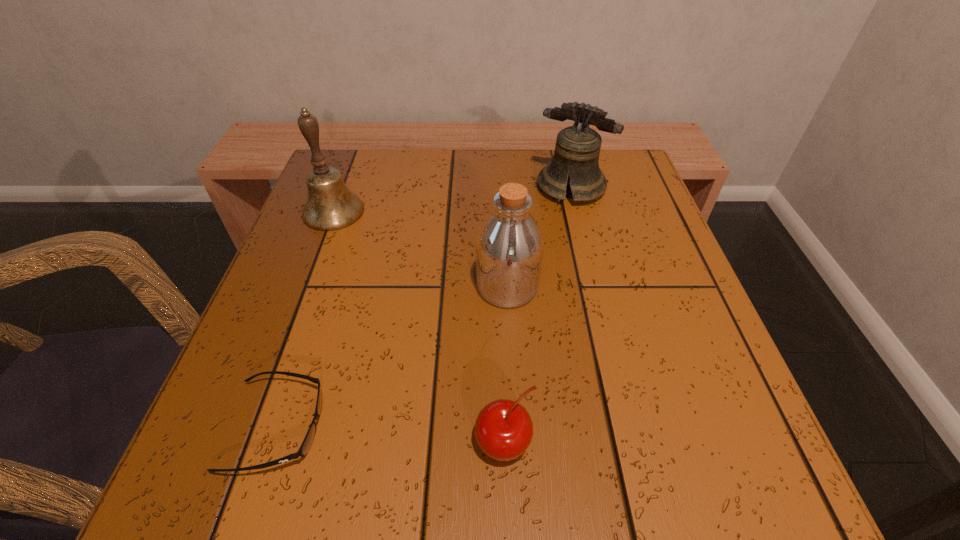
Locate an element on the screen. The width and height of the screenshot is (960, 540). vacant space located 0.210m on the front-facing side of the sunglasses is located at coordinates (473, 427).

The width and height of the screenshot is (960, 540). Identify the location of cherry that is at the near edge. (503, 429).

Find the location of a particular element. The width and height of the screenshot is (960, 540). sunglasses present at the near edge is located at coordinates (306, 444).

What are the coordinates of `bell located at the left edge` in the screenshot? It's located at (330, 206).

I want to click on sunglasses that is at the left edge, so click(306, 444).

At what (x,y) coordinates should I click in order to perform the action: click on object positioned at the right edge. Please return your answer as a coordinate pair (x, y). Looking at the image, I should click on (577, 149).

Where is `object that is positioned at the far left corner`? This screenshot has height=540, width=960. object that is positioned at the far left corner is located at coordinates (330, 206).

I want to click on object that is at the near left corner, so click(306, 444).

Locate an element on the screen. The height and width of the screenshot is (540, 960). object that is positioned at the far right corner is located at coordinates (577, 149).

Where is `free location at the far edge of the desktop`? free location at the far edge of the desktop is located at coordinates (418, 206).